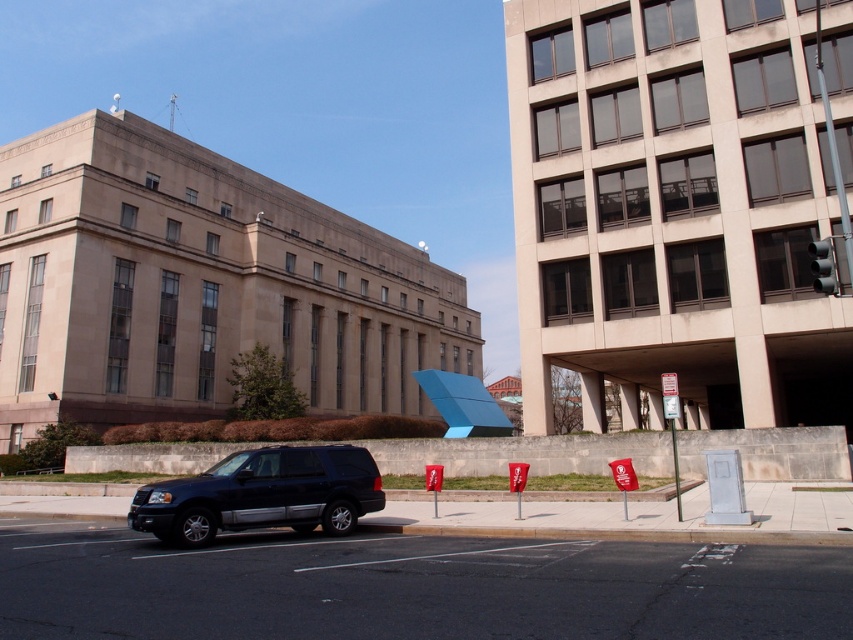
Question: From the image, what is the correct spatial relationship of shiny black suv at center in relation to metallic silver parking sign at right?

Choices:
 (A) right
 (B) left

Answer: (B)

Question: Which point appears farthest from the camera in this image?

Choices:
 (A) (250, 476)
 (B) (666, 380)

Answer: (B)

Question: Which point is farther to the camera?

Choices:
 (A) shiny black suv at center
 (B) metallic silver parking sign at right

Answer: (A)

Question: Does shiny black suv at center lie behind metallic silver parking sign at right?

Choices:
 (A) yes
 (B) no

Answer: (A)

Question: Is shiny black suv at center positioned behind metallic silver parking sign at right?

Choices:
 (A) yes
 (B) no

Answer: (A)